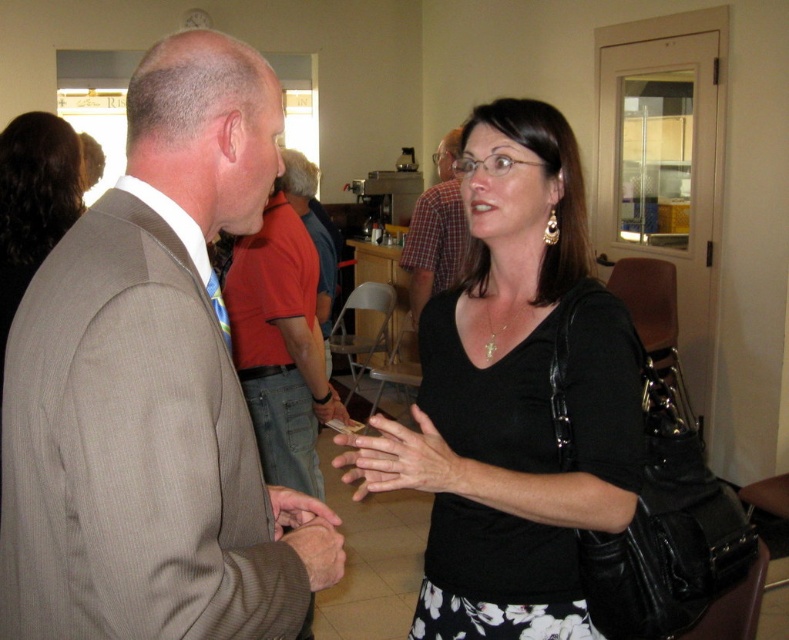
Which is below, black matte shirt at center or plaid shirt at center?

black matte shirt at center is below.

From the picture: Does black matte shirt at center appear over plaid shirt at center?

Actually, black matte shirt at center is below plaid shirt at center.

Image resolution: width=789 pixels, height=640 pixels. In order to click on black matte shirt at center in this screenshot , I will do `click(511, 397)`.

Which is more to the right, light brown suit at center or black matte shirt at center?

Positioned to the right is black matte shirt at center.

Is light brown suit at center further to camera compared to black matte shirt at center?

That is False.

Identify the location of light brown suit at center. This screenshot has width=789, height=640. (152, 390).

Between point (62, 580) and point (447, 232), which one is positioned behind?

Point (447, 232)

Is light brown suit at center behind plaid shirt at center?

No, it is in front of plaid shirt at center.

I want to click on light brown suit at center, so click(152, 390).